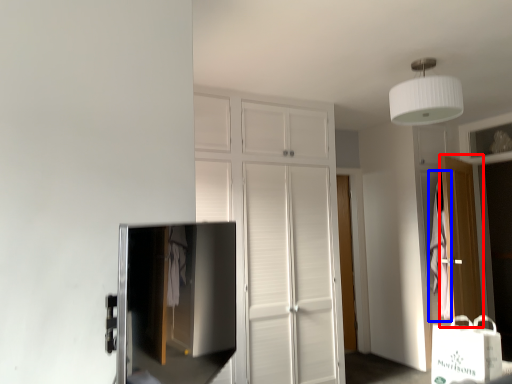
Question: Among these objects, which one is nearest to the camera, door (highlighted by a red box) or blanket (highlighted by a blue box)?

Choices:
 (A) door
 (B) blanket

Answer: (A)